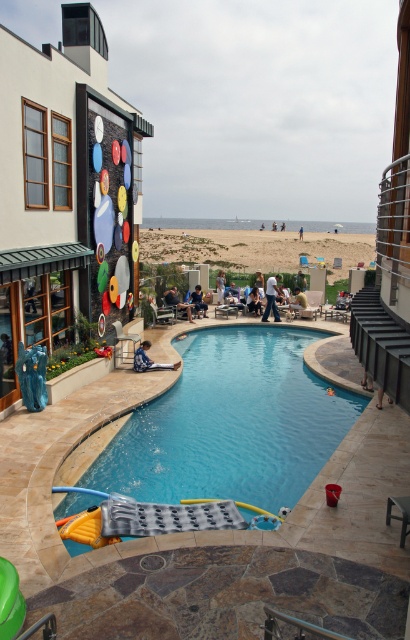
Does beige sand at center have a smaller size compared to light blue jeans at center?

No.

Who is more forward, (344, 234) or (273, 320)?

Point (273, 320) is in front.

The width and height of the screenshot is (410, 640). In order to click on beige sand at center in this screenshot , I will do `click(255, 248)`.

Where is `beige sand at center`? The image size is (410, 640). beige sand at center is located at coordinates 255,248.

Is dark blue jeans at center wider than green fabric chair at center?

No.

Between point (216, 300) and point (298, 273), which one is positioned in front?

Point (216, 300)

At what (x,y) coordinates should I click in order to perform the action: click on dark blue jeans at center. Please return your answer as a coordinate pair (x, y). The height and width of the screenshot is (640, 410). Looking at the image, I should click on (220, 285).

Find the location of a particular element. dark blue jeans at center is located at coordinates (220, 285).

Can you confirm if dark blue jeans at center is wider than light brown wooden chair at lower right?

Yes.

Is dark blue jeans at center further to camera compared to light brown wooden chair at lower right?

Yes, dark blue jeans at center is further from the viewer.

Between point (216, 282) and point (377, 406), which one is positioned behind?

The point (216, 282) is more distant.

At what (x,y) coordinates should I click in order to perform the action: click on dark blue jeans at center. Please return your answer as a coordinate pair (x, y). Looking at the image, I should click on (220, 285).